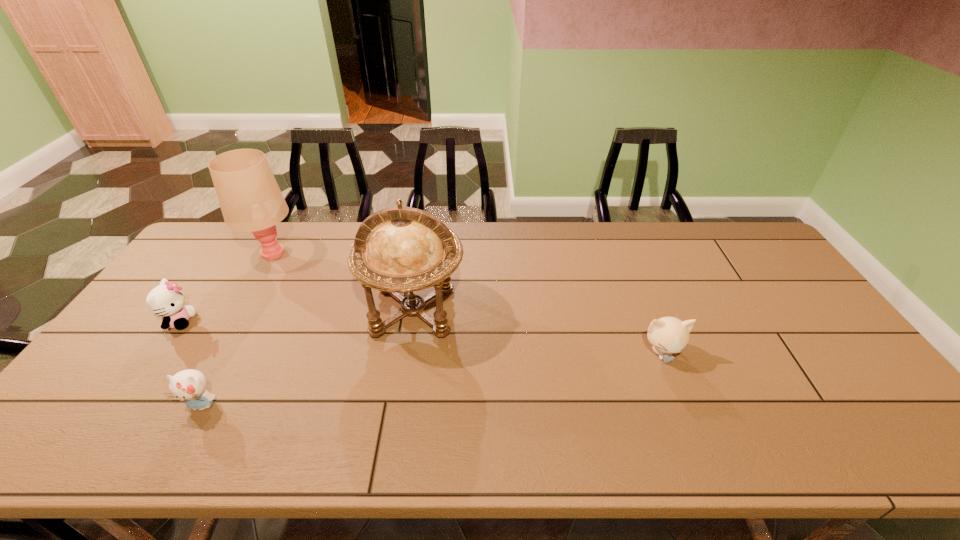
You are a GUI agent. You are given a task and a screenshot of the screen. Output one action in this format:
    pyautogui.click(x=<x>, y=<y>)
    Task: Click on the object that is the second closest one to the farthest object
    
    Given the screenshot: What is the action you would take?
    pyautogui.click(x=396, y=250)

This screenshot has width=960, height=540. I want to click on kitten identified as the second closest to the rightmost object, so click(166, 300).

I want to click on kitten that stands as the closest to the rightmost object, so click(x=189, y=385).

Where is `vacant region that satisfies the following two spatial constraints: 1. on the front-facing side of the second object from right to left; 2. on the front-facing side of the leftmost kitten`? vacant region that satisfies the following two spatial constraints: 1. on the front-facing side of the second object from right to left; 2. on the front-facing side of the leftmost kitten is located at coordinates (412, 321).

Image resolution: width=960 pixels, height=540 pixels. Find the location of `free space that satisfies the following two spatial constraints: 1. on the front-facing side of the second object from right to left; 2. on the front-facing side of the farthest kitten`. free space that satisfies the following two spatial constraints: 1. on the front-facing side of the second object from right to left; 2. on the front-facing side of the farthest kitten is located at coordinates pyautogui.click(x=412, y=321).